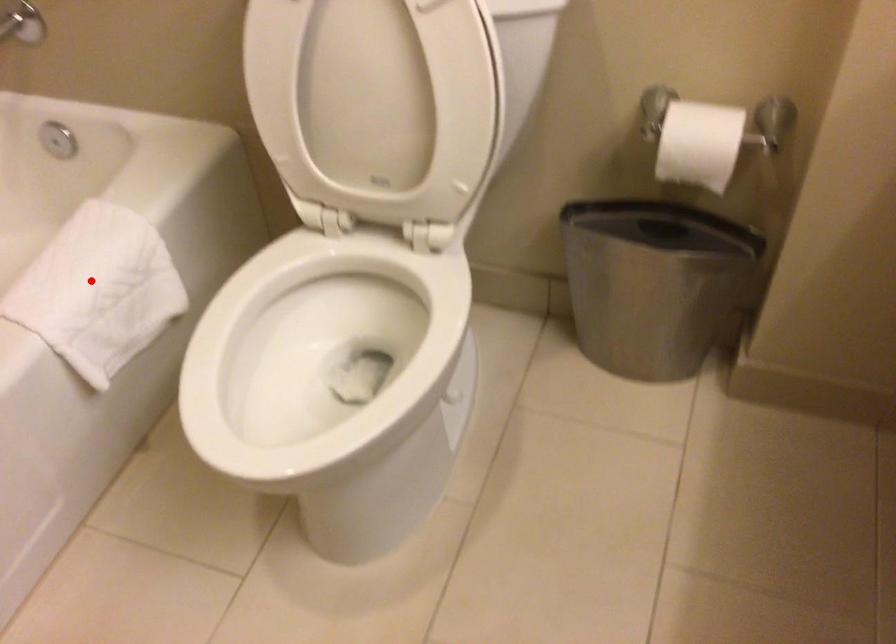
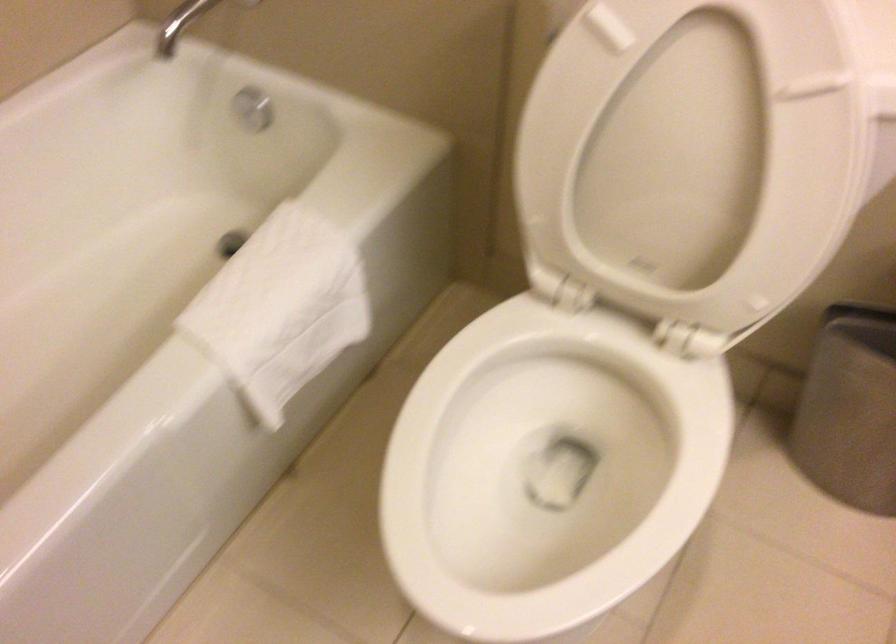
Question: I am providing you with two images of the same scene from different viewpoints. A red point is marked on the first image. Can you still see the location of the red point in image 2?

Choices:
 (A) Yes
 (B) No

Answer: (A)